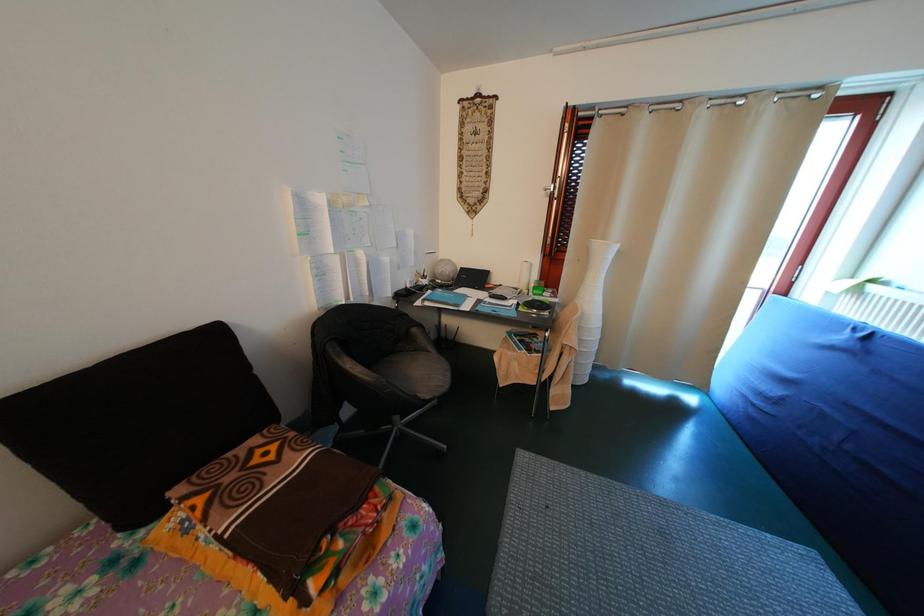
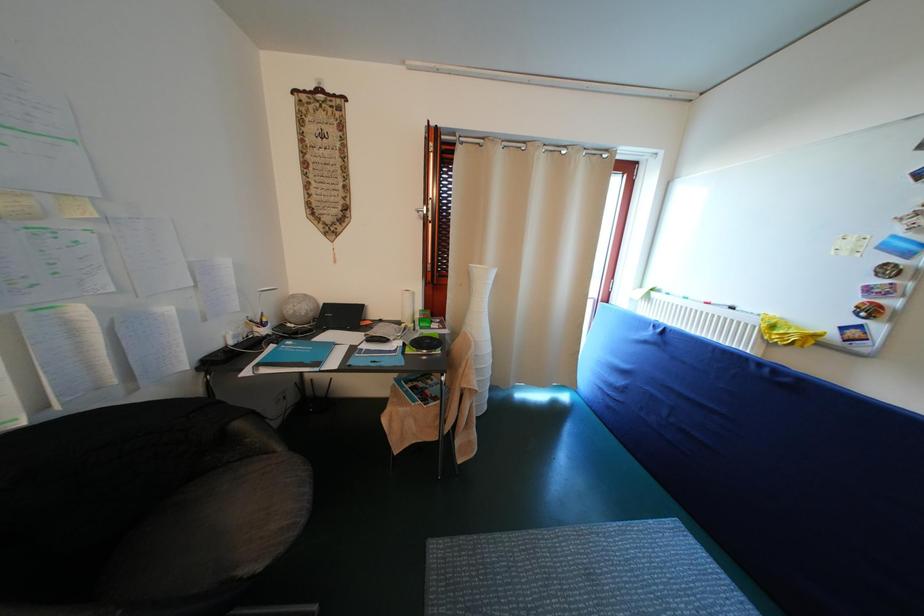
Question: The camera is either moving clockwise (left) or counter-clockwise (right) around the object. The first image is from the beginning of the video and the second image is from the end. Is the camera moving left or right when shooting the video?

Choices:
 (A) Left
 (B) Right

Answer: (A)